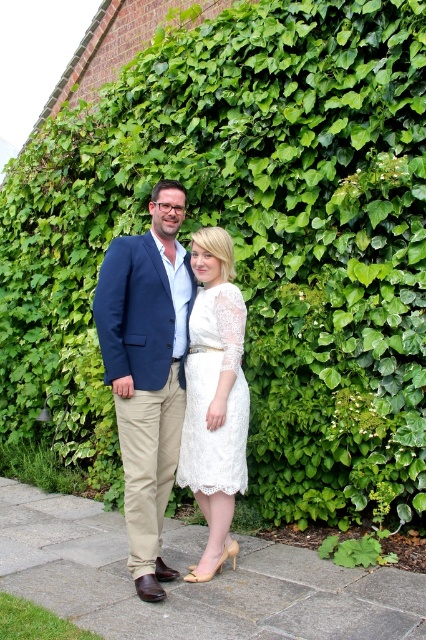
Question: Which point is farther to the camera?

Choices:
 (A) (204, 404)
 (B) (117, 390)

Answer: (A)

Question: Is navy blue blazer at center below white lace dress at center?

Choices:
 (A) yes
 (B) no

Answer: (B)

Question: Can you confirm if navy blue blazer at center is positioned below white lace dress at center?

Choices:
 (A) no
 (B) yes

Answer: (A)

Question: Which object is farther from the camera taking this photo?

Choices:
 (A) white lace dress at center
 (B) navy blue blazer at center

Answer: (A)

Question: Which point appears farthest from the camera in this image?

Choices:
 (A) (100, 276)
 (B) (218, 488)

Answer: (A)

Question: Is navy blue blazer at center to the left of white lace dress at center from the viewer's perspective?

Choices:
 (A) no
 (B) yes

Answer: (B)